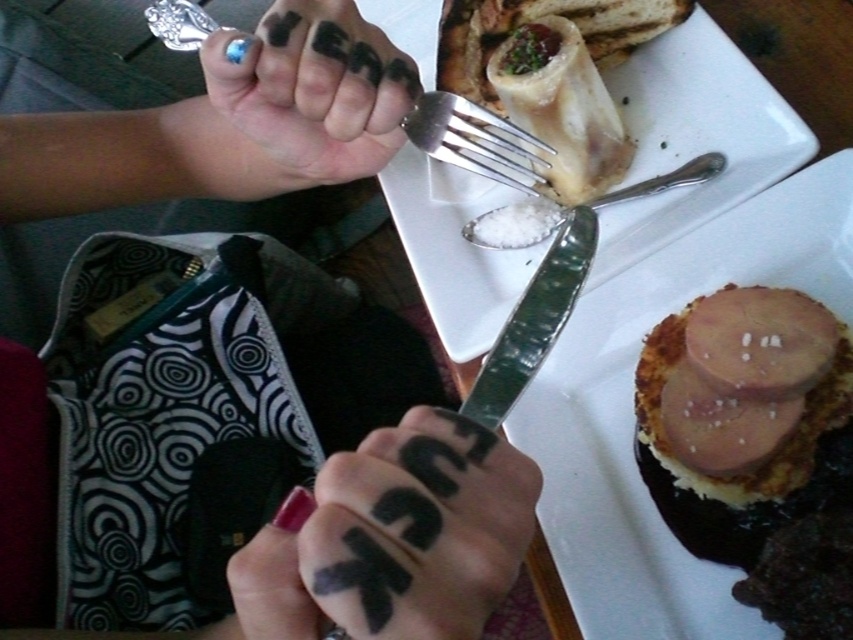
You are a guest at a dinner and see the white ceramic plate at center and the white creamy bone marrow at upper center on the table. Which object is nearer to you?

The white ceramic plate at center is closer to the viewer than the white creamy bone marrow at upper center.

You are a guest at a dinner party and notice the black matte knuckles at center and the slightly pinkish matte ham at upper right on the table. Which of these two items is wider?

The black matte knuckles at center is wider than the slightly pinkish matte ham at upper right.

You are standing at a distance and want to reach the point marked at coordinates point (756, 90). If you can stretch your arm 20 inches, will you be able to touch it?

The point point (756, 90) is 21.81 inches away from you, so you cannot reach it with a 20 inch arm stretch.